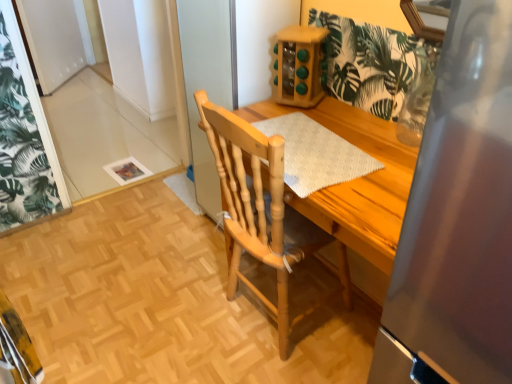
Identify the location of free point above white textured placemat at center (from a real-world perspective). (314, 150).